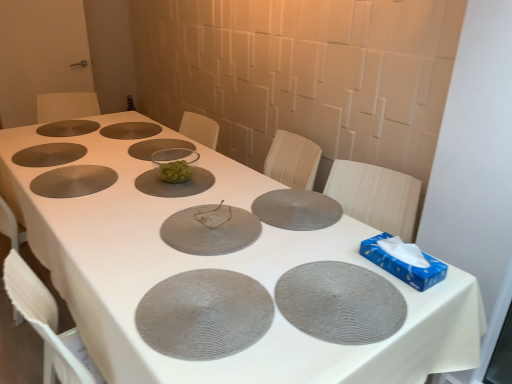
This screenshot has height=384, width=512. I want to click on vacant space behind gray textured placemat at center, positioned as the 10th glass plate in back-to-front order, so click(212, 247).